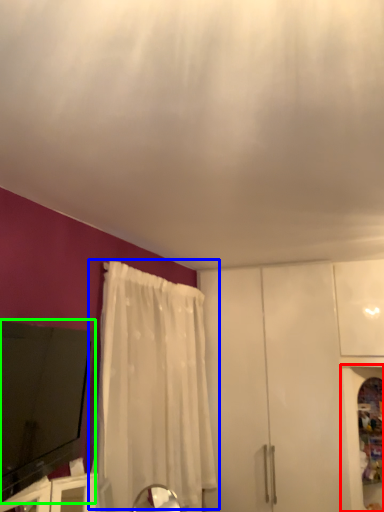
Question: Which object is the closest to the cabinetry (highlighted by a red box)? Choose among these: curtain (highlighted by a blue box) or electronic (highlighted by a green box).

Choices:
 (A) curtain
 (B) electronic

Answer: (A)